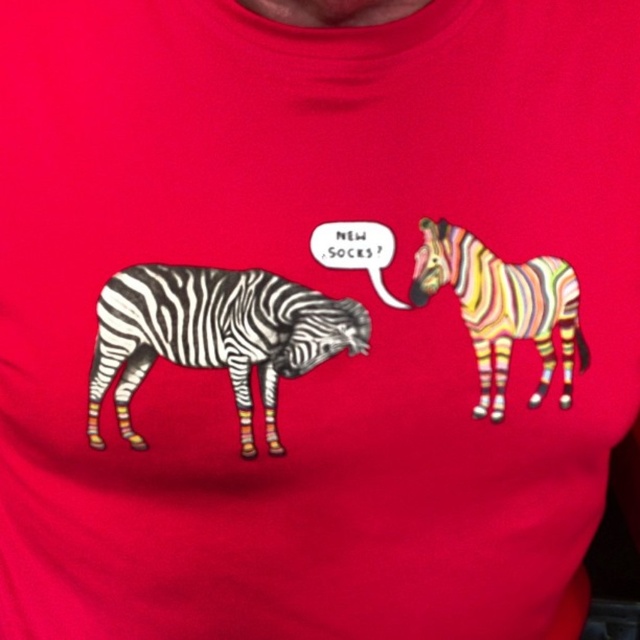
Question: Which point is closer to the camera?

Choices:
 (A) (113, 276)
 (B) (440, 227)

Answer: (A)

Question: Is black and white striped zebra at left to the right of rainbow striped zebra at right from the viewer's perspective?

Choices:
 (A) yes
 (B) no

Answer: (B)

Question: In this image, where is black and white striped zebra at left located relative to rainbow striped zebra at right?

Choices:
 (A) left
 (B) right

Answer: (A)

Question: Where is black and white striped zebra at left located in relation to rainbow striped zebra at right in the image?

Choices:
 (A) above
 (B) below

Answer: (B)

Question: Which point is farther to the camera?

Choices:
 (A) rainbow striped zebra at right
 (B) black and white striped zebra at left

Answer: (A)